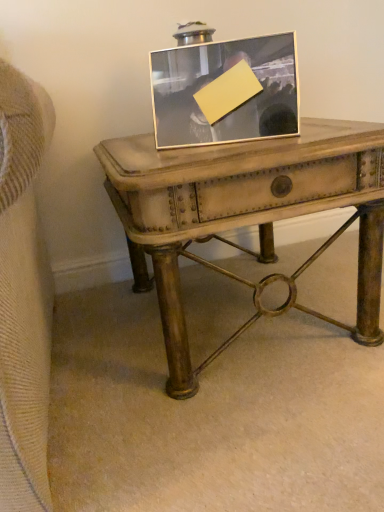
Question: From a real-world perspective, is distressed wood table at center located beneath silver/metallic picture frame at center?

Choices:
 (A) yes
 (B) no

Answer: (A)

Question: Is distressed wood table at center closer to camera compared to silver/metallic picture frame at center?

Choices:
 (A) yes
 (B) no

Answer: (A)

Question: Is silver/metallic picture frame at center completely or partially inside distressed wood table at center?

Choices:
 (A) no
 (B) yes

Answer: (A)

Question: Is distressed wood table at center looking in the opposite direction of silver/metallic picture frame at center?

Choices:
 (A) yes
 (B) no

Answer: (B)

Question: Could you tell me if distressed wood table at center is facing silver/metallic picture frame at center?

Choices:
 (A) no
 (B) yes

Answer: (A)

Question: From a real-world perspective, is distressed wood table at center over silver/metallic picture frame at center?

Choices:
 (A) yes
 (B) no

Answer: (B)

Question: Is distressed wood table at center at the back of silver/metallic picture frame at center?

Choices:
 (A) yes
 (B) no

Answer: (B)

Question: Does silver/metallic picture frame at center appear on the right side of distressed wood table at center?

Choices:
 (A) yes
 (B) no

Answer: (B)

Question: Considering the relative positions of silver/metallic picture frame at center and distressed wood table at center in the image provided, is silver/metallic picture frame at center in front of distressed wood table at center?

Choices:
 (A) no
 (B) yes

Answer: (A)

Question: Is silver/metallic picture frame at center facing towards distressed wood table at center?

Choices:
 (A) yes
 (B) no

Answer: (B)

Question: Is distressed wood table at center completely or partially inside silver/metallic picture frame at center?

Choices:
 (A) yes
 (B) no

Answer: (B)

Question: Considering the relative sizes of silver/metallic picture frame at center and distressed wood table at center in the image provided, is silver/metallic picture frame at center shorter than distressed wood table at center?

Choices:
 (A) yes
 (B) no

Answer: (A)

Question: From a real-world perspective, relative to silver/metallic picture frame at center, is distressed wood table at center vertically above or below?

Choices:
 (A) above
 (B) below

Answer: (B)